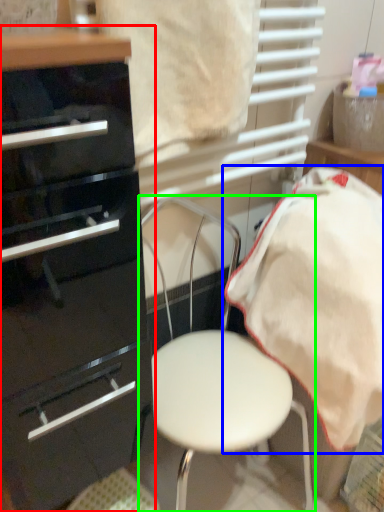
Question: Based on their relative distances, which object is farther from chest of drawers (highlighted by a red box)? Choose from bedding (highlighted by a blue box) and chair (highlighted by a green box).

Choices:
 (A) bedding
 (B) chair

Answer: (A)